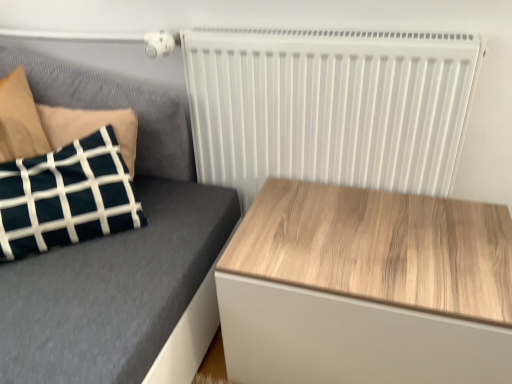
Question: Does velvet dark blue pillow at left have a lesser width compared to wooden table at right?

Choices:
 (A) no
 (B) yes

Answer: (B)

Question: Considering the relative sizes of velvet dark blue pillow at left and wooden table at right in the image provided, is velvet dark blue pillow at left shorter than wooden table at right?

Choices:
 (A) no
 (B) yes

Answer: (A)

Question: Is velvet dark blue pillow at left closer to camera compared to wooden table at right?

Choices:
 (A) yes
 (B) no

Answer: (B)

Question: Could you tell me if velvet dark blue pillow at left is turned towards wooden table at right?

Choices:
 (A) yes
 (B) no

Answer: (B)

Question: Is the position of velvet dark blue pillow at left more distant than that of wooden table at right?

Choices:
 (A) no
 (B) yes

Answer: (B)

Question: In terms of width, does velvet dark blue pillow at left look wider or thinner when compared to wooden table at right?

Choices:
 (A) wide
 (B) thin

Answer: (B)

Question: From a real-world perspective, relative to wooden table at right, is velvet dark blue pillow at left vertically above or below?

Choices:
 (A) above
 (B) below

Answer: (A)

Question: Considering their positions, is velvet dark blue pillow at left located in front of or behind wooden table at right?

Choices:
 (A) front
 (B) behind

Answer: (B)

Question: In terms of size, does velvet dark blue pillow at left appear bigger or smaller than wooden table at right?

Choices:
 (A) small
 (B) big

Answer: (A)

Question: Is velvet dark blue pillow at left to the left or to the right of white matte radiator at upper right in the image?

Choices:
 (A) left
 (B) right

Answer: (A)

Question: In terms of width, does velvet dark blue pillow at left look wider or thinner when compared to white matte radiator at upper right?

Choices:
 (A) wide
 (B) thin

Answer: (A)

Question: Is point (93, 350) positioned closer to the camera than point (194, 59)?

Choices:
 (A) farther
 (B) closer

Answer: (B)

Question: From the image's perspective, is velvet dark blue pillow at left above or below white matte radiator at upper right?

Choices:
 (A) below
 (B) above

Answer: (A)

Question: From a real-world perspective, is wooden table at right positioned above or below velvet dark blue pillow at left?

Choices:
 (A) above
 (B) below

Answer: (B)

Question: Would you say wooden table at right is inside or outside velvet dark blue pillow at left?

Choices:
 (A) outside
 (B) inside

Answer: (A)